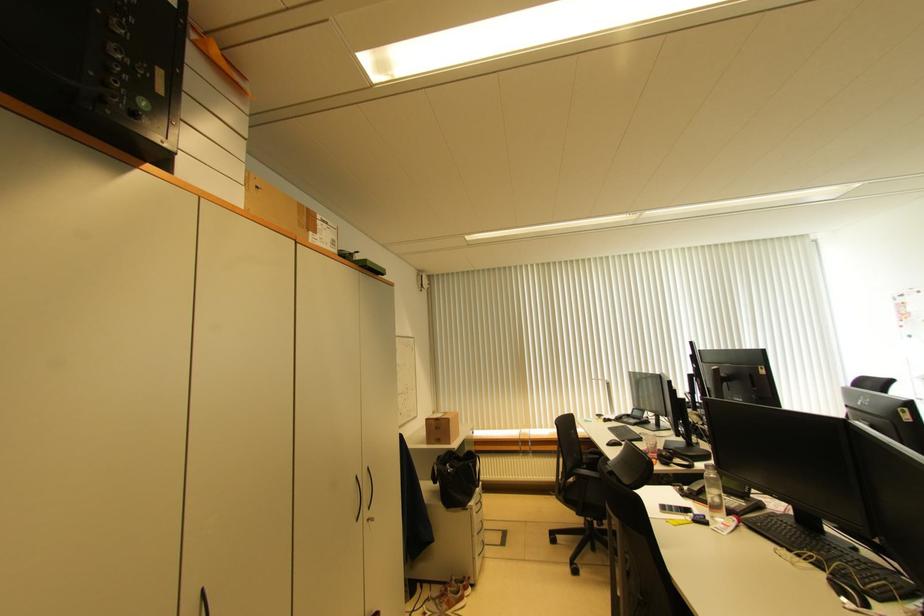
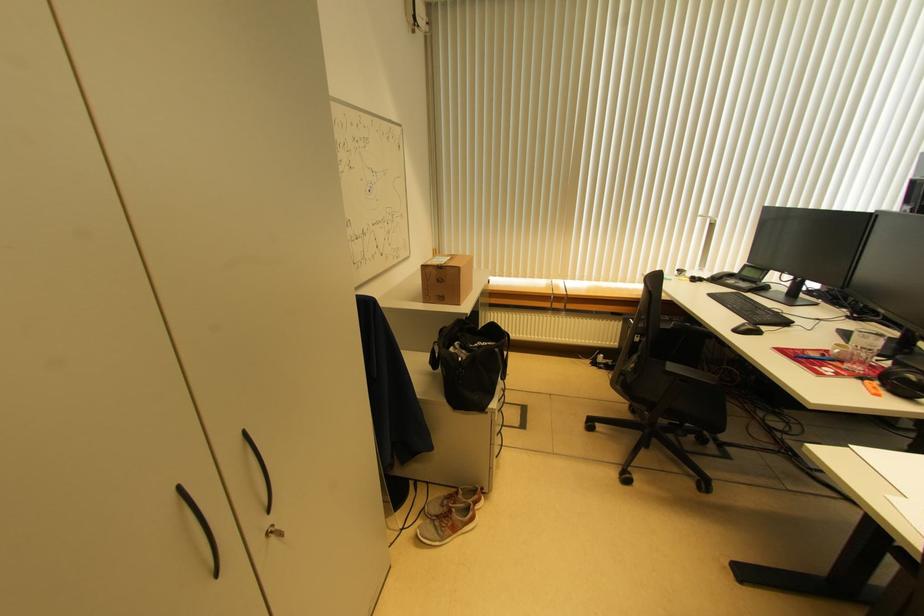
Question: The images are taken continuously from a first-person perspective. In which direction are you moving?

Choices:
 (A) Left
 (B) Right
 (C) Forward
 (D) Backward

Answer: (C)